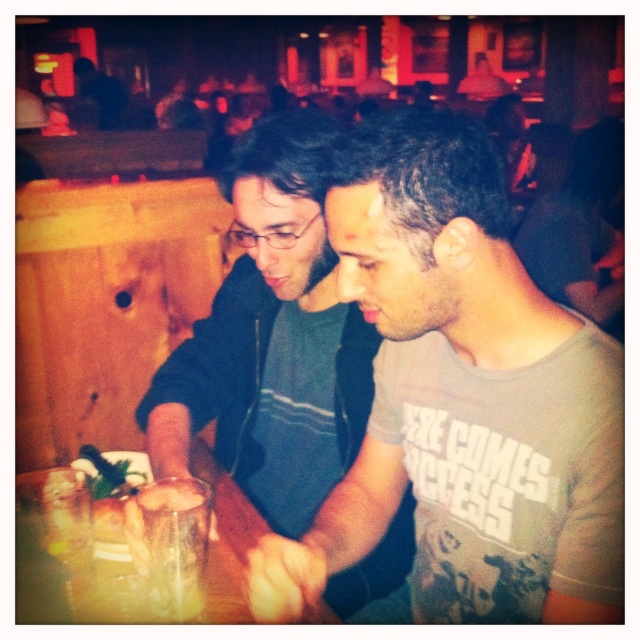
Question: Estimate the real-world distances between objects in this image. Which object is farther from the gray cotton t-shirt at center?

Choices:
 (A) green leafy vegetable at center
 (B) translucent glass table at center

Answer: (A)

Question: Is gray cotton t-shirt at center positioned before translucent glass table at center?

Choices:
 (A) no
 (B) yes

Answer: (B)

Question: Estimate the real-world distances between objects in this image. Which object is farther from the translucent glass table at center?

Choices:
 (A) gray cotton t-shirt at center
 (B) translucent glass at center
 (C) green leafy vegetable at center
 (D) matte black shirt at center

Answer: (A)

Question: Does gray cotton t-shirt at center lie in front of matte black shirt at center?

Choices:
 (A) no
 (B) yes

Answer: (B)

Question: Where is translucent glass table at center located in relation to green leafy vegetable at center in the image?

Choices:
 (A) above
 (B) below

Answer: (B)

Question: Which of the following is the closest to the observer?

Choices:
 (A) (216, 561)
 (B) (493, 554)
 (C) (362, 428)
 (D) (129, 452)

Answer: (B)